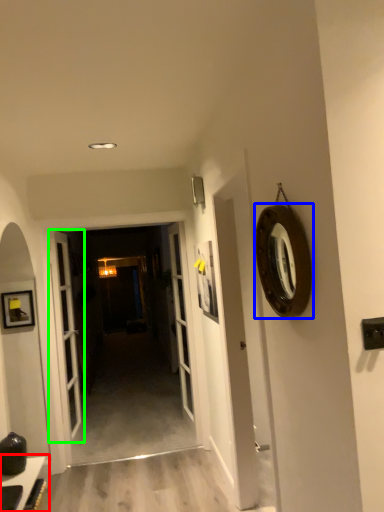
Question: Based on their relative distances, which object is farther from table (highlighted by a red box)? Choose from oval (highlighted by a blue box) and door (highlighted by a green box).

Choices:
 (A) oval
 (B) door

Answer: (A)